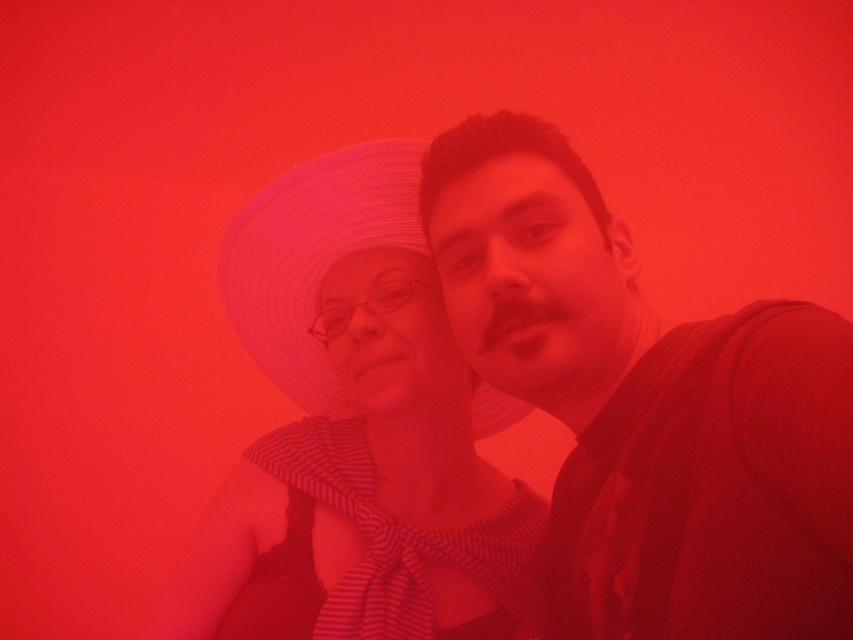
Question: Does matte black shirt at center have a smaller size compared to white straw hat at center?

Choices:
 (A) no
 (B) yes

Answer: (A)

Question: Which point is closer to the camera taking this photo?

Choices:
 (A) (769, 536)
 (B) (363, 248)

Answer: (A)

Question: Observing the image, what is the correct spatial positioning of matte black shirt at center in reference to white straw hat at center?

Choices:
 (A) below
 (B) above

Answer: (A)

Question: Which object is positioned farthest from the matte black shirt at center?

Choices:
 (A) matte white hat at center
 (B) white straw hat at center

Answer: (B)

Question: Which is farther from the white straw hat at center?

Choices:
 (A) matte black shirt at center
 (B) matte white hat at center

Answer: (A)

Question: In this image, where is matte black shirt at center located relative to matte white hat at center?

Choices:
 (A) left
 (B) right

Answer: (B)